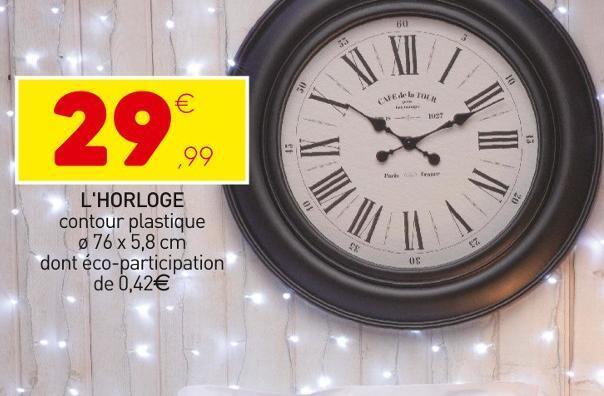
Where is `black clock surround`? The image size is (604, 396). black clock surround is located at coordinates (295, 21).